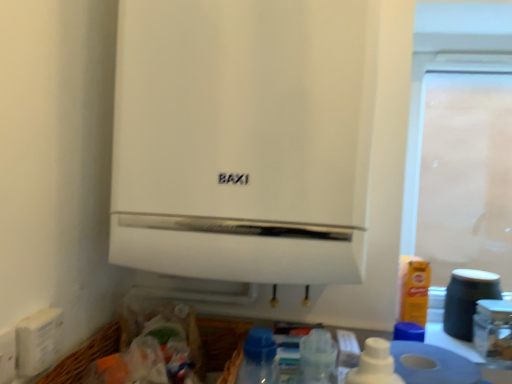
Question: Is matte black jar at lower right located within white matte toilet paper at lower right?

Choices:
 (A) no
 (B) yes

Answer: (A)

Question: From a real-world perspective, is white matte toilet paper at lower right located beneath matte black jar at lower right?

Choices:
 (A) no
 (B) yes

Answer: (B)

Question: Can we say white matte toilet paper at lower right lies outside matte black jar at lower right?

Choices:
 (A) no
 (B) yes

Answer: (B)

Question: Considering the relative sizes of white matte toilet paper at lower right and matte black jar at lower right in the image provided, is white matte toilet paper at lower right shorter than matte black jar at lower right?

Choices:
 (A) no
 (B) yes

Answer: (B)

Question: Considering the relative positions of white matte toilet paper at lower right and matte black jar at lower right in the image provided, is white matte toilet paper at lower right to the left of matte black jar at lower right from the viewer's perspective?

Choices:
 (A) yes
 (B) no

Answer: (A)

Question: Considering the relative sizes of white matte toilet paper at lower right and matte black jar at lower right in the image provided, is white matte toilet paper at lower right wider than matte black jar at lower right?

Choices:
 (A) yes
 (B) no

Answer: (A)

Question: Is matte black jar at lower right touching white matte toilet paper at lower right?

Choices:
 (A) no
 (B) yes

Answer: (A)

Question: From the image's perspective, is matte black jar at lower right beneath white matte toilet paper at lower right?

Choices:
 (A) yes
 (B) no

Answer: (B)

Question: From a real-world perspective, is matte black jar at lower right positioned over white matte toilet paper at lower right based on gravity?

Choices:
 (A) no
 (B) yes

Answer: (B)

Question: Considering the relative positions of matte black jar at lower right and white matte toilet paper at lower right in the image provided, is matte black jar at lower right behind white matte toilet paper at lower right?

Choices:
 (A) no
 (B) yes

Answer: (B)

Question: Can you confirm if matte black jar at lower right is smaller than white matte toilet paper at lower right?

Choices:
 (A) no
 (B) yes

Answer: (B)

Question: From the image's perspective, is matte black jar at lower right on top of white matte toilet paper at lower right?

Choices:
 (A) no
 (B) yes

Answer: (B)

Question: Is matte black jar at lower right wider than transparent plastic screen door at upper right?

Choices:
 (A) no
 (B) yes

Answer: (B)